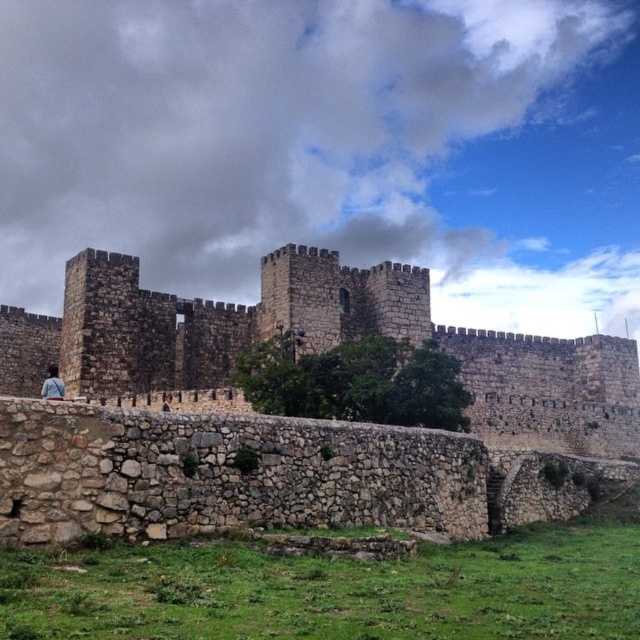
You are a tourist visiting the historic stone castle. You notice a denim jacket at lower left and the brown stone castle at center. Which object is larger in size?

The brown stone castle at center is bigger than the denim jacket at lower left.

You are a tour guide explaining the castle to visitors. You point out the brown stone castle at center and the denim jacket at lower left. Which object is significantly taller?

The brown stone castle at center is much taller than the denim jacket at lower left.

In the scene shown: You are a tourist visiting the historic stone castle. You notice a denim jacket at lower left and the brown stone castle at center. From your vantage point, which object is closer to you?

The denim jacket at lower left is behind the brown stone castle at center, so the brown stone castle at center is closer to you.